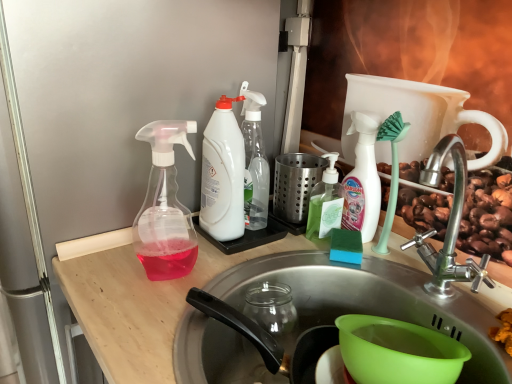
Where is `free area in between transparent plastic spray bottle at left, acting as the 5th bottle starting from the right, and green translucent soap dispenser at center, which is the 2th bottle in right-to-left order`? The image size is (512, 384). free area in between transparent plastic spray bottle at left, acting as the 5th bottle starting from the right, and green translucent soap dispenser at center, which is the 2th bottle in right-to-left order is located at coordinates (255, 252).